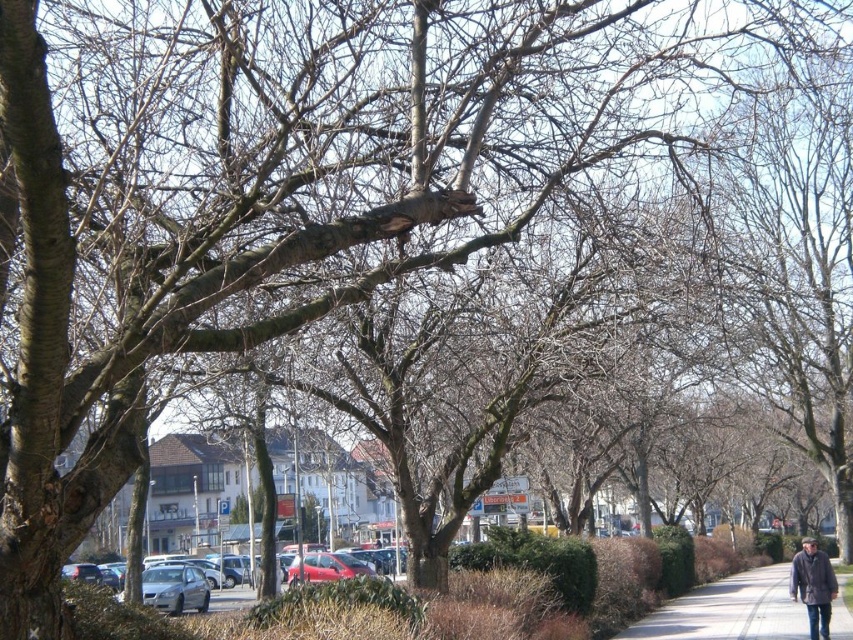
Question: Is gray asphalt pavement at lower right wider than dark gray wool coat at right?

Choices:
 (A) yes
 (B) no

Answer: (A)

Question: Is gray asphalt pavement at lower right positioned at the back of dark gray wool coat at right?

Choices:
 (A) yes
 (B) no

Answer: (A)

Question: Among these objects, which one is farthest from the camera?

Choices:
 (A) gray asphalt pavement at lower right
 (B) dark gray wool coat at right

Answer: (A)

Question: Is gray asphalt pavement at lower right to the right of dark gray wool coat at right from the viewer's perspective?

Choices:
 (A) no
 (B) yes

Answer: (B)

Question: Among these objects, which one is nearest to the camera?

Choices:
 (A) gray asphalt pavement at lower right
 (B) dark gray wool coat at right

Answer: (B)